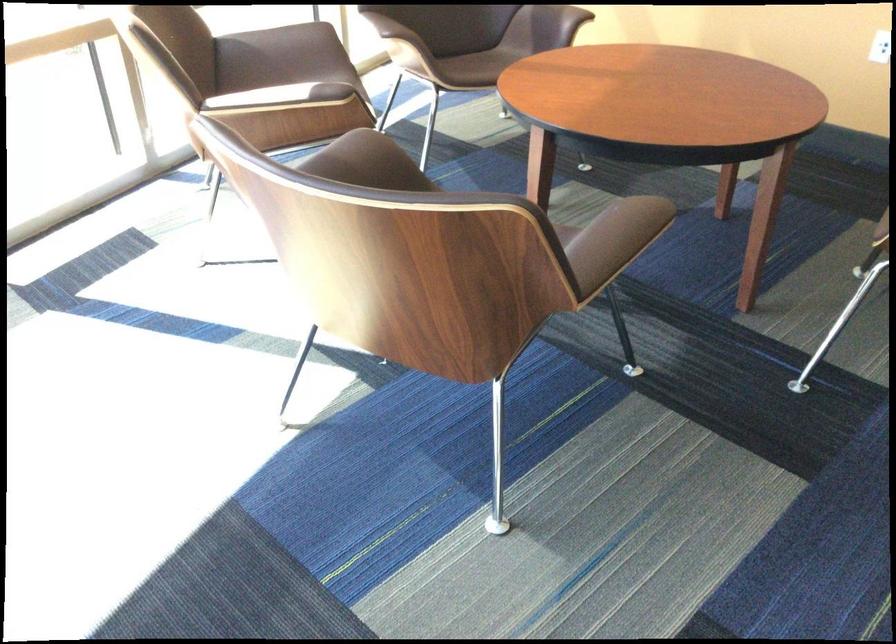
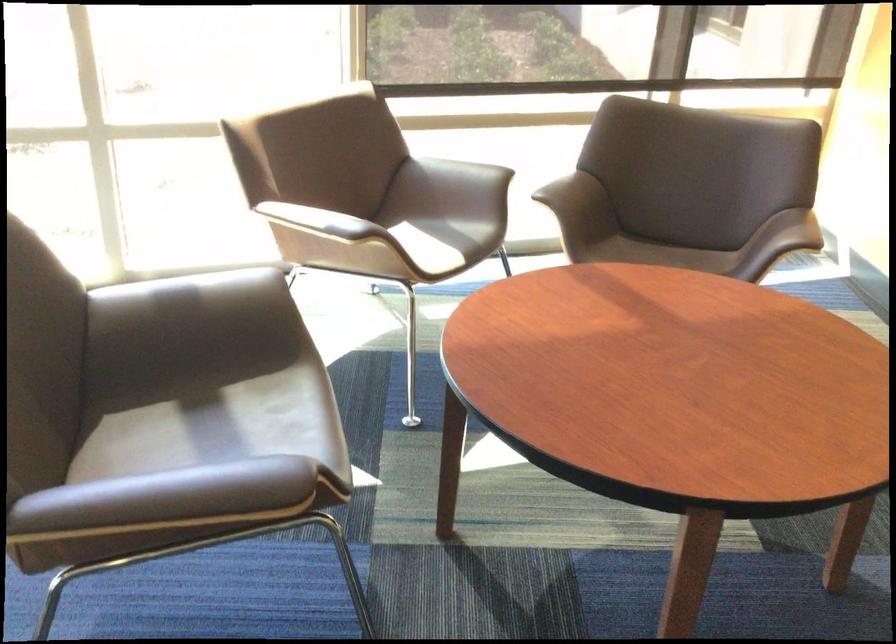
The point at [279,102] is marked in the first image. Where is the corresponding point in the second image?

(314, 221)